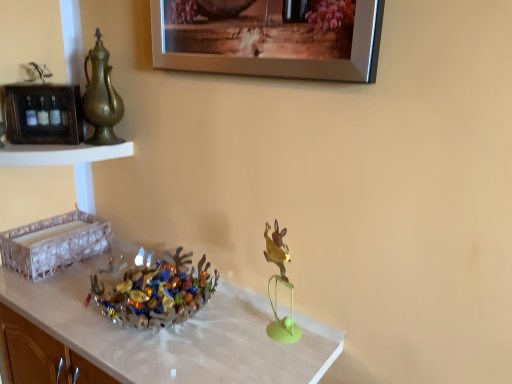
At what (x,y) coordinates should I click in order to perform the action: click on vacant region to the right of translucent glass bowl at center. Please return your answer as a coordinate pair (x, y). The height and width of the screenshot is (384, 512). Looking at the image, I should click on (246, 334).